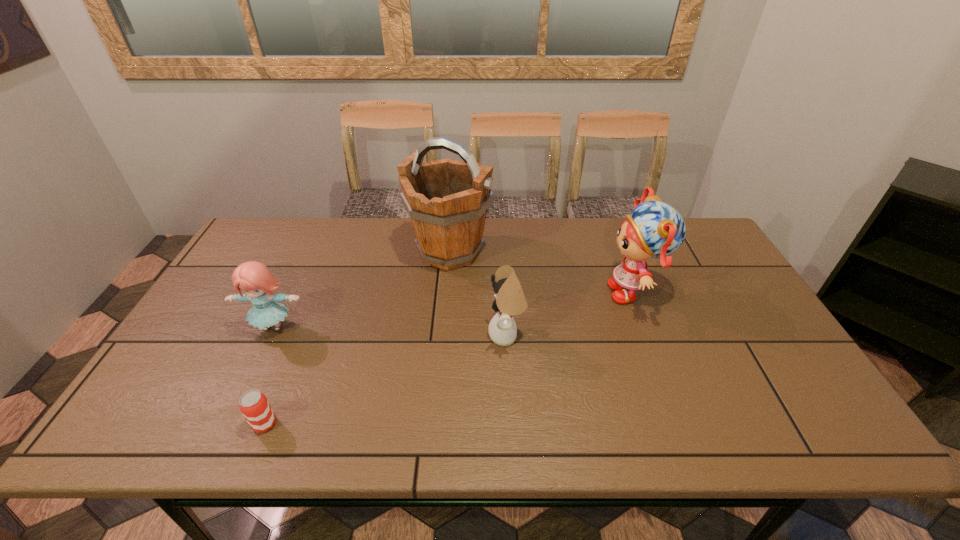
Where is `free space that satisfies the following two spatial constraints: 1. on the face of the second tallest object; 2. on the front side of the shortest object`? free space that satisfies the following two spatial constraints: 1. on the face of the second tallest object; 2. on the front side of the shortest object is located at coordinates (684, 424).

Find the location of a particular element. The image size is (960, 540). vacant space that satisfies the following two spatial constraints: 1. on the front-facing side of the leftmost doll; 2. on the right side of the beer can is located at coordinates (228, 424).

Where is `free space in the image that satisfies the following two spatial constraints: 1. on the face of the rightmost doll; 2. on the front-facing side of the leftmost doll`? This screenshot has height=540, width=960. free space in the image that satisfies the following two spatial constraints: 1. on the face of the rightmost doll; 2. on the front-facing side of the leftmost doll is located at coordinates (647, 327).

The image size is (960, 540). I want to click on vacant space that satisfies the following two spatial constraints: 1. on the face of the fourth shortest object; 2. on the front-facing side of the leftmost doll, so click(x=647, y=327).